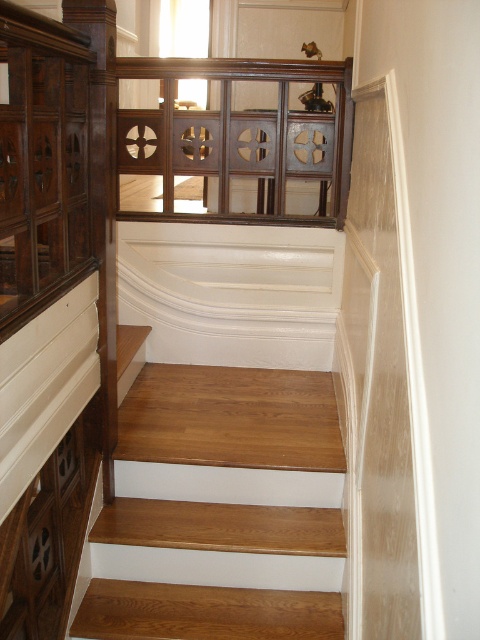
Question: Among these points, which one is farthest from the camera?

Choices:
 (A) (245, 387)
 (B) (237, 58)

Answer: (A)

Question: Is wooden stairs at center positioned before dark wood paneling at upper center?

Choices:
 (A) no
 (B) yes

Answer: (B)

Question: Among these points, which one is farthest from the camera?

Choices:
 (A) (132, 392)
 (B) (196, 64)

Answer: (B)

Question: Does wooden stairs at center appear under dark wood paneling at upper center?

Choices:
 (A) no
 (B) yes

Answer: (B)

Question: Does wooden stairs at center come behind dark wood paneling at upper center?

Choices:
 (A) no
 (B) yes

Answer: (A)